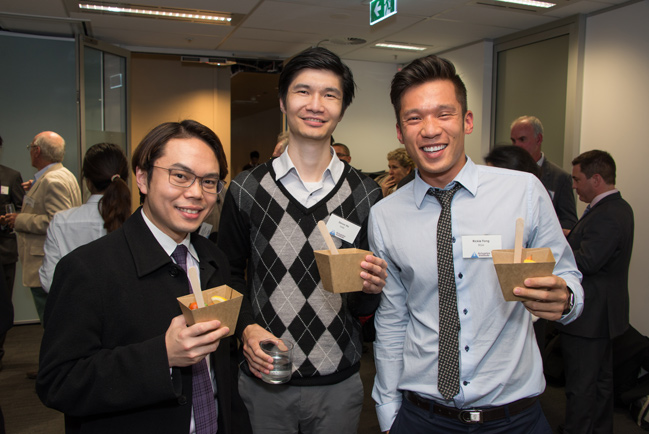
Locate an element on the screen. door is located at coordinates (520, 77), (232, 118).